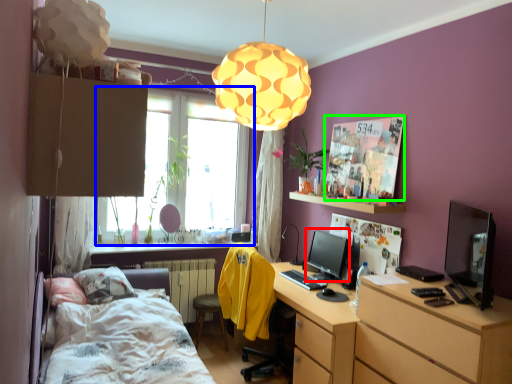
Question: Which object is positioned closest to computer monitor (highlighted by a red box)? Select from window (highlighted by a blue box) and poster page (highlighted by a green box).

Choices:
 (A) window
 (B) poster page

Answer: (B)